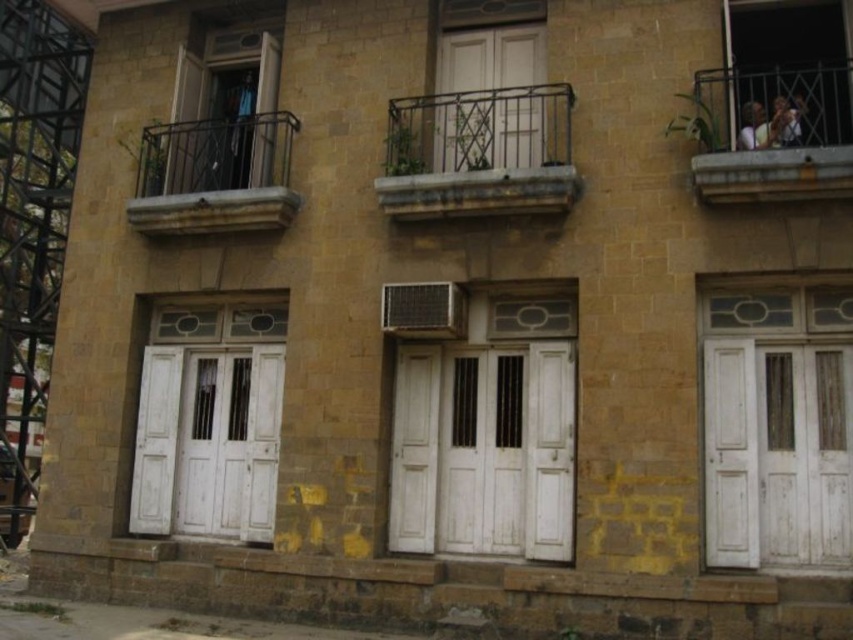
Question: Is rustic metal balcony at upper left further to the viewer compared to light brown wooden chair at upper right?

Choices:
 (A) no
 (B) yes

Answer: (B)

Question: Does translucent glass door at center have a greater width compared to light brown wooden chair at upper right?

Choices:
 (A) no
 (B) yes

Answer: (B)

Question: Considering the real-world distances, which object is farthest from the rusty metal balcony at center?

Choices:
 (A) rustic metal balcony at upper left
 (B) light brown wooden frame at upper right
 (C) white wooden door at left

Answer: (C)

Question: Does translucent glass door at center come in front of matte glass door at upper left?

Choices:
 (A) yes
 (B) no

Answer: (A)

Question: Estimate the real-world distances between objects in this image. Which object is closer to the rusty metal balcony at center?

Choices:
 (A) rustic metal balcony at upper left
 (B) white wooden door at left
 (C) matte glass door at upper left

Answer: (A)

Question: Which point is farther to the camera?

Choices:
 (A) rusty metal balcony at center
 (B) translucent glass door at center

Answer: (A)